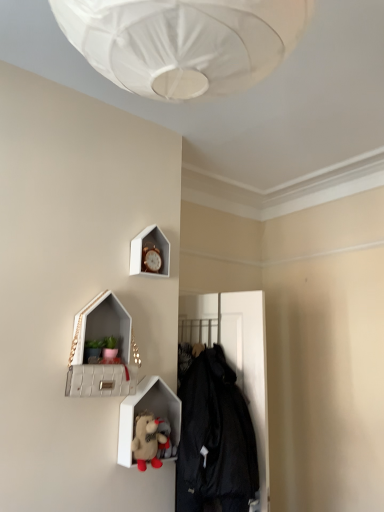
Image resolution: width=384 pixels, height=512 pixels. Describe the element at coordinates (150, 253) in the screenshot. I see `gold metallic clock at upper center` at that location.

In order to face gold metallic clock at upper center, should I rotate leftwards or rightwards?

Turn left by 5.655 degrees to look at gold metallic clock at upper center.

The width and height of the screenshot is (384, 512). I want to click on fluffy plush toy at lower center, so click(148, 441).

Identify the location of white quilted leather medicine cabinet at upper left. This screenshot has width=384, height=512. (105, 351).

How much distance is there between fluffy plush toy at lower center and white quilted leather medicine cabinet at upper left?

A distance of 29.71 centimeters exists between fluffy plush toy at lower center and white quilted leather medicine cabinet at upper left.

Is fluffy plush toy at lower center behind white quilted leather medicine cabinet at upper left?

Yes, it is behind white quilted leather medicine cabinet at upper left.

Considering the relative positions of fluffy plush toy at lower center and white quilted leather medicine cabinet at upper left in the image provided, is fluffy plush toy at lower center to the left or to the right of white quilted leather medicine cabinet at upper left?

In the image, fluffy plush toy at lower center appears on the right side of white quilted leather medicine cabinet at upper left.

Does fluffy plush toy at lower center have a lesser height compared to white quilted leather medicine cabinet at upper left?

Yes.

Which is behind, point (152, 420) or point (160, 237)?

The point (160, 237) is farther from the camera.

Considering their positions, is fluffy plush toy at lower center located in front of or behind gold metallic clock at upper center?

In the image, fluffy plush toy at lower center appears in front of gold metallic clock at upper center.

Considering the sizes of fluffy plush toy at lower center and gold metallic clock at upper center in the image, is fluffy plush toy at lower center taller or shorter than gold metallic clock at upper center?

Clearly, fluffy plush toy at lower center is shorter compared to gold metallic clock at upper center.

Who is bigger, fluffy plush toy at lower center or gold metallic clock at upper center?

With larger size is fluffy plush toy at lower center.

Is white quilted leather medicine cabinet at upper left located within black matte coat at center?

That's incorrect, white quilted leather medicine cabinet at upper left is not inside black matte coat at center.

Is black matte coat at center far away from white quilted leather medicine cabinet at upper left?

black matte coat at center is actually quite close to white quilted leather medicine cabinet at upper left.

From the image's perspective, is black matte coat at center positioned above or below white quilted leather medicine cabinet at upper left?

Clearly, from the image's perspective, black matte coat at center is below white quilted leather medicine cabinet at upper left.

Considering the relative sizes of white textured shelf at lower center and gold metallic clock at upper center in the image provided, is white textured shelf at lower center wider than gold metallic clock at upper center?

Yes, white textured shelf at lower center is wider than gold metallic clock at upper center.

From the image's perspective, which one is positioned higher, white textured shelf at lower center or gold metallic clock at upper center?

gold metallic clock at upper center appears higher in the image.

The height and width of the screenshot is (512, 384). In order to click on clock behind the white textured shelf at lower center in this screenshot , I will do `click(150, 253)`.

Which of these two, gold metallic clock at upper center or black matte coat at center, is thinner?

Thinner between the two is gold metallic clock at upper center.

Could you tell me if gold metallic clock at upper center is facing black matte coat at center?

No.

From the image's perspective, who appears lower, gold metallic clock at upper center or black matte coat at center?

black matte coat at center is shown below in the image.

Considering the relative sizes of gold metallic clock at upper center and fluffy plush toy at lower center in the image provided, is gold metallic clock at upper center smaller than fluffy plush toy at lower center?

Correct, gold metallic clock at upper center occupies less space than fluffy plush toy at lower center.

Is fluffy plush toy at lower center surrounded by gold metallic clock at upper center?

Actually, fluffy plush toy at lower center is outside gold metallic clock at upper center.

From a real-world perspective, is gold metallic clock at upper center under fluffy plush toy at lower center?

No, from a real-world perspective, gold metallic clock at upper center is not under fluffy plush toy at lower center.

Measure the distance from gold metallic clock at upper center to fluffy plush toy at lower center.

gold metallic clock at upper center and fluffy plush toy at lower center are 28.42 inches apart from each other.

From a real-world perspective, which object stands above the other?

gold metallic clock at upper center, from a real-world perspective.

Considering the positions of objects white quilted leather medicine cabinet at upper left and gold metallic clock at upper center in the image provided, who is more to the right, white quilted leather medicine cabinet at upper left or gold metallic clock at upper center?

gold metallic clock at upper center.

Looking at this image, can you confirm if white quilted leather medicine cabinet at upper left is wider than gold metallic clock at upper center?

Indeed, white quilted leather medicine cabinet at upper left has a greater width compared to gold metallic clock at upper center.

Locate an element on the screen. medicine cabinet located on the left of fluffy plush toy at lower center is located at coordinates (105, 351).

At what (x,y) coordinates should I click in order to perform the action: click on clock lying above the fluffy plush toy at lower center (from the image's perspective). Please return your answer as a coordinate pair (x, y). This screenshot has width=384, height=512. Looking at the image, I should click on (150, 253).

Estimate the real-world distances between objects in this image. Which object is further from black matte coat at center, white textured shelf at lower center or white quilted leather medicine cabinet at upper left?

The object further to black matte coat at center is white quilted leather medicine cabinet at upper left.

Based on their spatial positions, is black matte coat at center or gold metallic clock at upper center closer to fluffy plush toy at lower center?

Among the two, black matte coat at center is located nearer to fluffy plush toy at lower center.

Which object lies further to the anchor point white textured shelf at lower center, fluffy plush toy at lower center or white quilted leather medicine cabinet at upper left?

white quilted leather medicine cabinet at upper left lies further to white textured shelf at lower center than the other object.

Which object lies further to the anchor point black matte coat at center, fluffy plush toy at lower center or gold metallic clock at upper center?

gold metallic clock at upper center.

Based on their spatial positions, is white quilted leather medicine cabinet at upper left or gold metallic clock at upper center closer to black matte coat at center?

white quilted leather medicine cabinet at upper left lies closer to black matte coat at center than the other object.

When comparing their distances from gold metallic clock at upper center, does fluffy plush toy at lower center or black matte coat at center seem further?

The object further to gold metallic clock at upper center is fluffy plush toy at lower center.

Looking at the image, which one is located further to fluffy plush toy at lower center, white quilted leather medicine cabinet at upper left or white textured shelf at lower center?

white quilted leather medicine cabinet at upper left.

Estimate the real-world distances between objects in this image. Which object is closer to gold metallic clock at upper center, white quilted leather medicine cabinet at upper left or white textured shelf at lower center?

The object closer to gold metallic clock at upper center is white quilted leather medicine cabinet at upper left.

This screenshot has height=512, width=384. Identify the location of toy that lies between white quilted leather medicine cabinet at upper left and black matte coat at center from top to bottom. (148, 441).

This screenshot has width=384, height=512. I want to click on shelf between gold metallic clock at upper center and fluffy plush toy at lower center in the up-down direction, so click(x=147, y=409).

Where is `shelf that lies between white quilted leather medicine cabinet at upper left and black matte coat at center from top to bottom`? shelf that lies between white quilted leather medicine cabinet at upper left and black matte coat at center from top to bottom is located at coordinates (147, 409).

At what (x,y) coordinates should I click in order to perform the action: click on medicine cabinet between gold metallic clock at upper center and fluffy plush toy at lower center in the vertical direction. Please return your answer as a coordinate pair (x, y). Looking at the image, I should click on (105, 351).